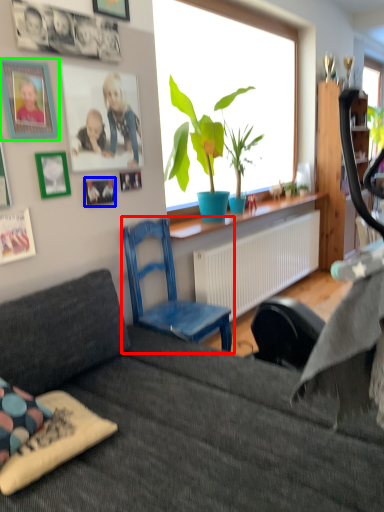
Question: Considering the real-world distances, which object is farthest from chair (highlighted by a red box)? picture frame (highlighted by a blue box) or picture frame (highlighted by a green box)?

Choices:
 (A) picture frame
 (B) picture frame

Answer: (B)